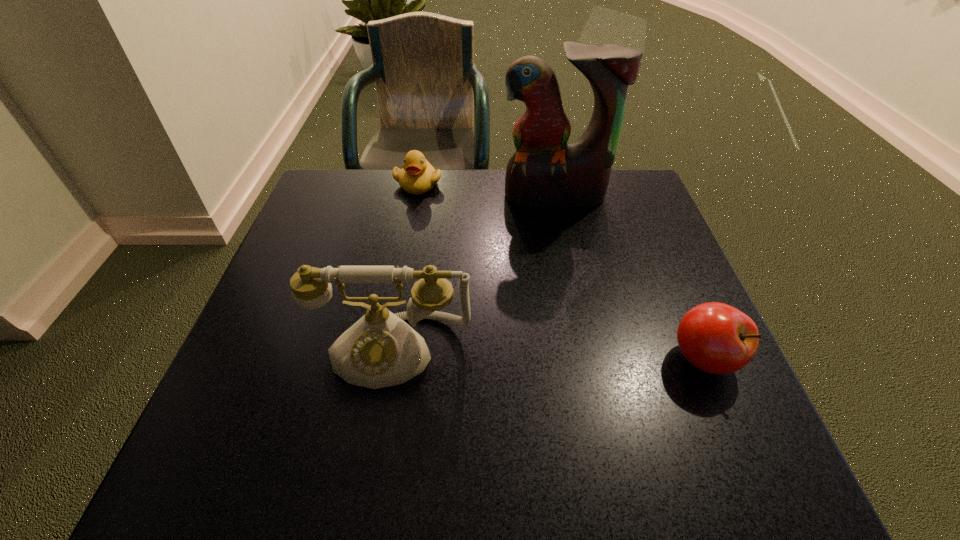
The width and height of the screenshot is (960, 540). Identify the location of telephone. (380, 350).

Where is `the rightmost object`? This screenshot has height=540, width=960. the rightmost object is located at coordinates click(x=716, y=338).

The height and width of the screenshot is (540, 960). Find the location of `apple`. apple is located at coordinates (716, 338).

You are a GUI agent. You are given a task and a screenshot of the screen. Output one action in this format:
    pyautogui.click(x=<x>, y=<y>)
    Task: Click on the parrot
    The height and width of the screenshot is (540, 960).
    Given the screenshot: What is the action you would take?
    click(544, 172)

Find the location of a particular element. the second object from right to left is located at coordinates (544, 172).

At what (x,y) coordinates should I click in order to perform the action: click on the shortest object. Please return your answer as a coordinate pair (x, y). Looking at the image, I should click on (418, 176).

Image resolution: width=960 pixels, height=540 pixels. Find the location of `vacant space located on the stem of the second shortest object`. vacant space located on the stem of the second shortest object is located at coordinates (731, 420).

Locate an element on the screen. The width and height of the screenshot is (960, 540). free space located at the face of the tallest object is located at coordinates (567, 328).

This screenshot has height=540, width=960. In order to click on free space located 0.230m at the face of the tallest object in this screenshot , I will do `click(561, 272)`.

Locate an element on the screen. vacant point located 0.210m at the face of the tallest object is located at coordinates (561, 266).